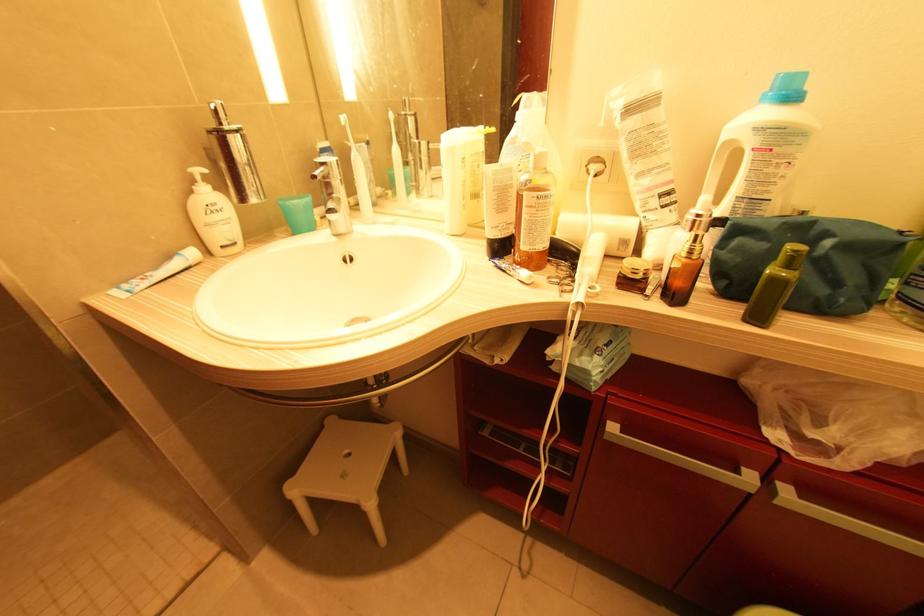
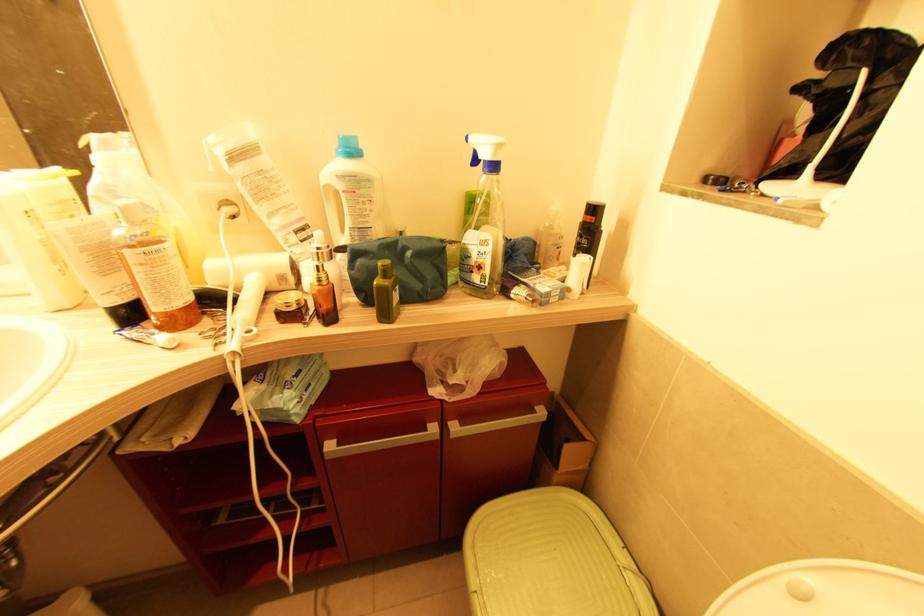
Locate, in the second image, the point that corresponds to (780,504) in the first image.

(454, 438)